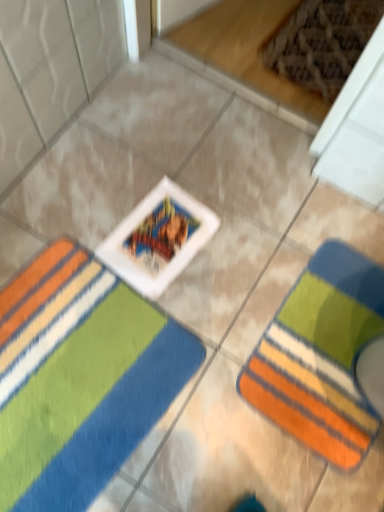
Question: Looking at the image, does multicolored striped towel at lower right, which is the second towel from left to right, seem bigger or smaller compared to multicolored plush towel at center, placed as the second towel when sorted from right to left?

Choices:
 (A) small
 (B) big

Answer: (A)

Question: Considering their positions, is multicolored striped towel at lower right, which ranks as the first towel in right-to-left order, located in front of or behind multicolored plush towel at center, which is the 1th towel in left-to-right order?

Choices:
 (A) behind
 (B) front

Answer: (A)

Question: In terms of height, does multicolored striped towel at lower right, which ranks as the first towel in right-to-left order, look taller or shorter compared to multicolored plush towel at center, placed as the second towel when sorted from right to left?

Choices:
 (A) short
 (B) tall

Answer: (A)

Question: Looking at their shapes, would you say multicolored plush towel at center, placed as the second towel when sorted from right to left, is wider or thinner than multicolored striped towel at lower right, which is the second towel from left to right?

Choices:
 (A) wide
 (B) thin

Answer: (A)

Question: Is point (41, 376) closer or farther from the camera than point (264, 365)?

Choices:
 (A) closer
 (B) farther

Answer: (A)

Question: Choose the correct answer: Is multicolored plush towel at center, placed as the second towel when sorted from right to left, inside multicolored striped towel at lower right, which is the second towel from left to right, or outside it?

Choices:
 (A) inside
 (B) outside

Answer: (B)

Question: Considering the positions of multicolored plush towel at center, placed as the second towel when sorted from right to left, and multicolored striped towel at lower right, which ranks as the first towel in right-to-left order, in the image, is multicolored plush towel at center, placed as the second towel when sorted from right to left, bigger or smaller than multicolored striped towel at lower right, which ranks as the first towel in right-to-left order,?

Choices:
 (A) small
 (B) big

Answer: (B)